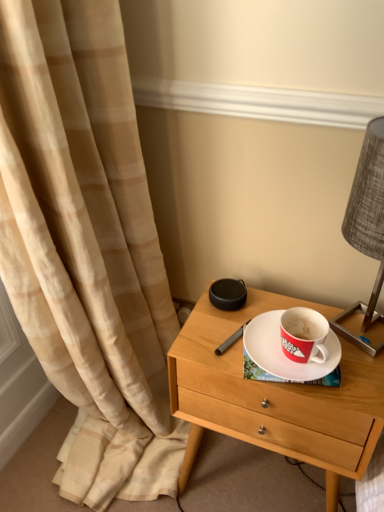
Locate an element on the screen. The width and height of the screenshot is (384, 512). vacant area that lies in front of textured gray lampshade at right is located at coordinates (352, 387).